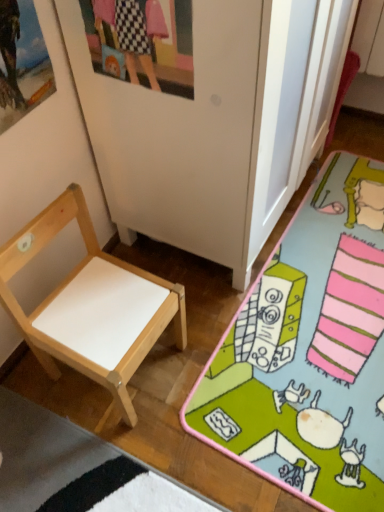
Identify the location of free space in front of natural wood chair at left. The width and height of the screenshot is (384, 512). (116, 458).